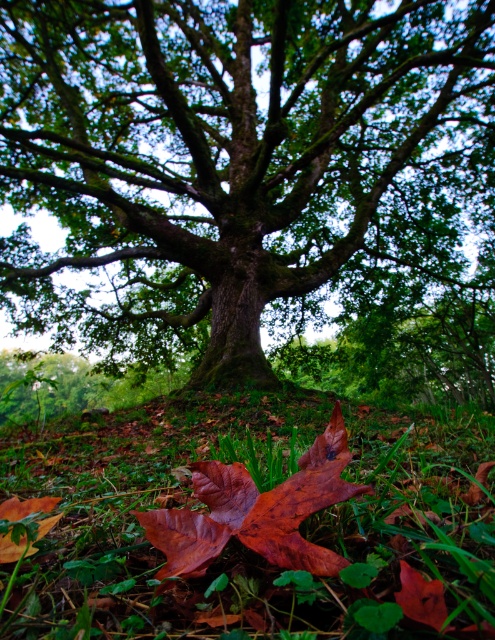
You are a hiker who wants to take a photo of the green rough bark tree at center and the green matte grass at lower center. Which object should you focus on if you want the one that takes up more space in the photo?

The green rough bark tree at center should be focused on because it has a larger size compared to the green matte grass at lower center, making it occupy more space in the photo.